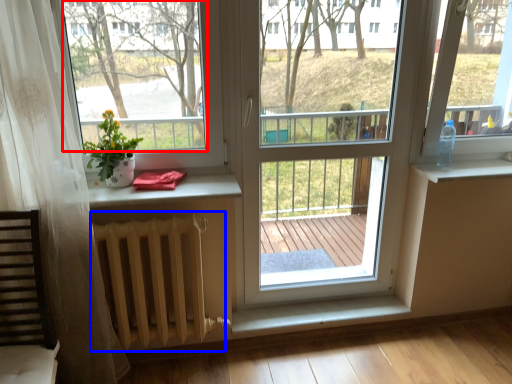
Question: Which object appears closest to the camera in this image, window screen (highlighted by a red box) or radiator (highlighted by a blue box)?

Choices:
 (A) window screen
 (B) radiator

Answer: (A)